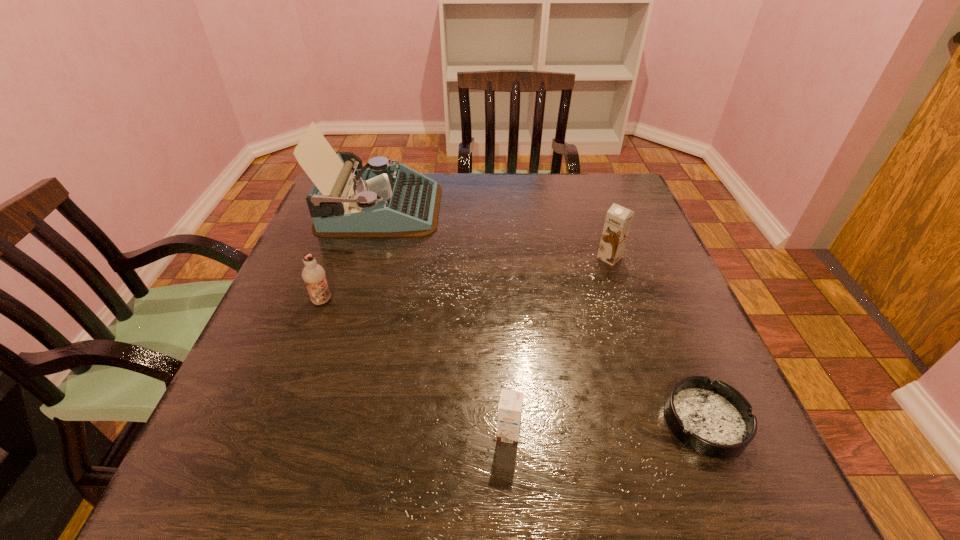
Find the location of a particular element. This screenshot has height=540, width=960. the farthest object is located at coordinates (384, 200).

At what (x,y) coordinates should I click in order to perform the action: click on the tallest object. Please return your answer as a coordinate pair (x, y). The height and width of the screenshot is (540, 960). Looking at the image, I should click on (384, 200).

Where is `the fourth nearest object`? the fourth nearest object is located at coordinates pos(618,220).

You are a GUI agent. You are given a task and a screenshot of the screen. Output one action in this format:
    pyautogui.click(x=<x>, y=<y>)
    Task: Click on the farthest chocolate milk
    The height and width of the screenshot is (540, 960).
    Given the screenshot: What is the action you would take?
    pyautogui.click(x=618, y=220)

Image resolution: width=960 pixels, height=540 pixels. In order to click on the third nearest object in this screenshot , I will do pos(313,274).

What are the coordinates of `the second nearest chocolate milk` in the screenshot? It's located at (313, 274).

The image size is (960, 540). What are the coordinates of `the fourth tallest object` in the screenshot? It's located at (510, 406).

In order to click on the second chocolate milk from right to left in this screenshot , I will do `click(510, 406)`.

The width and height of the screenshot is (960, 540). Identify the location of the shortest object. (712, 418).

This screenshot has height=540, width=960. Find the location of `vacant space situated on the typing side of the typewriter`. vacant space situated on the typing side of the typewriter is located at coordinates (472, 208).